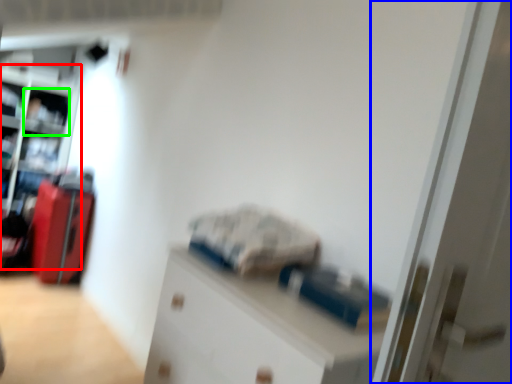
Question: Based on their relative distances, which object is nearer to bookshelf (highlighted by a red box)? Choose from door (highlighted by a blue box) and shelf (highlighted by a green box).

Choices:
 (A) door
 (B) shelf

Answer: (B)